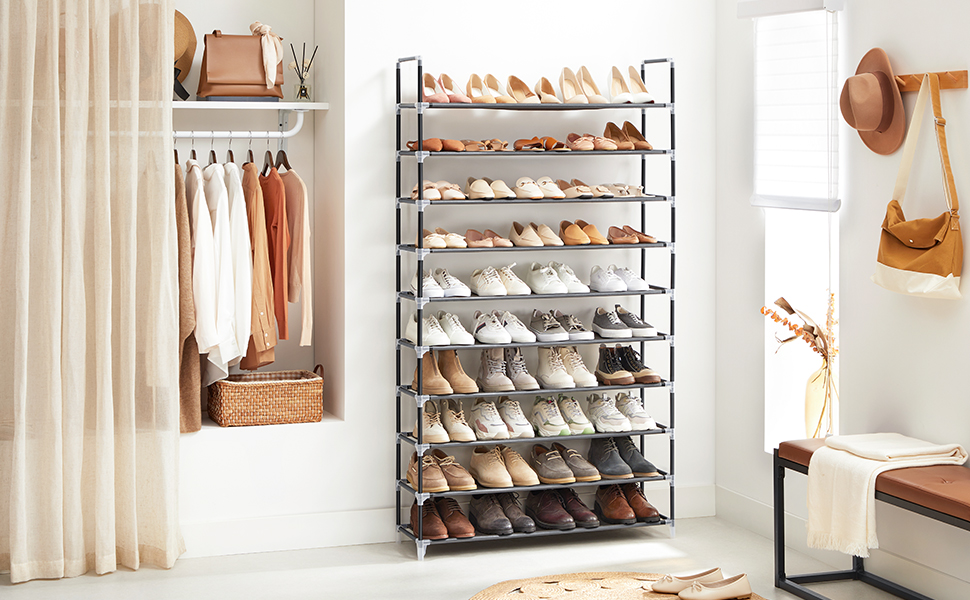
What are the coordinates of `4th shelf of shoe rack` in the screenshot? It's located at (437, 240), (458, 240), (483, 237), (504, 241), (531, 233), (551, 233), (572, 233), (594, 233), (621, 233), (643, 233).